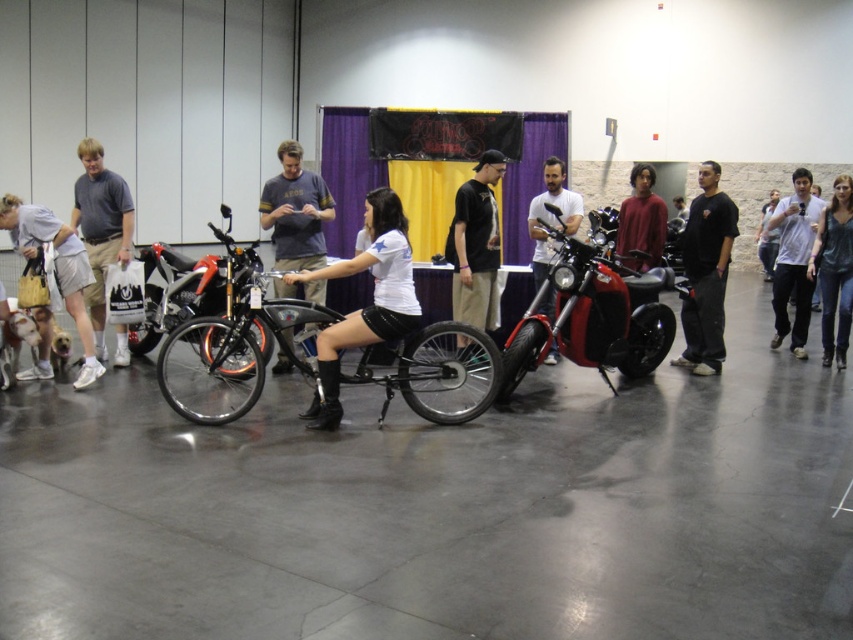
Question: Which of the following is the closest to the observer?

Choices:
 (A) shiny metallic bicycle at center
 (B) black matte shirt at right

Answer: (A)

Question: Is matte black shorts at center thinner than matte red sweater at center?

Choices:
 (A) no
 (B) yes

Answer: (A)

Question: Based on their relative distances, which object is nearer to the denim jeans at center?

Choices:
 (A) gray cotton t-shirt at left
 (B) shiny metallic bicycle at center
 (C) matte black shorts at center

Answer: (C)

Question: Which point is farther to the camera?

Choices:
 (A) white matte motorcycle at center
 (B) black matte shirt at right
 (C) gray cotton t-shirt at left
 (D) denim jeans at center

Answer: (D)

Question: From the image, what is the correct spatial relationship of matte black shorts at center in relation to gray cotton t-shirt at left?

Choices:
 (A) below
 (B) above

Answer: (A)

Question: Where is dark blue t-shirt at center located in relation to white cotton shirt at left in the image?

Choices:
 (A) below
 (B) above

Answer: (B)